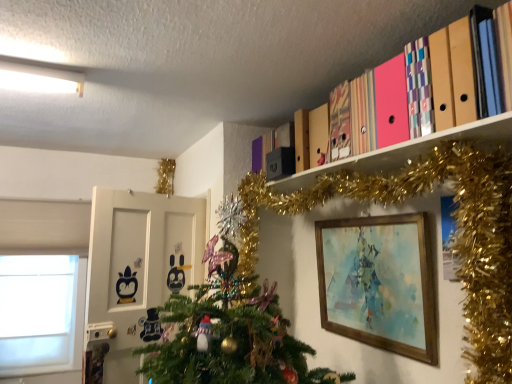
Question: Is green matte christmas tree at upper right inside the boundaries of matte cardboard folders at upper right, or outside?

Choices:
 (A) outside
 (B) inside

Answer: (A)

Question: In the image, is green matte christmas tree at upper right on the left side or the right side of matte cardboard folders at upper right?

Choices:
 (A) left
 (B) right

Answer: (A)

Question: Which of these objects is positioned closest to the matte cardboard folders at upper right?

Choices:
 (A) green matte christmas tree at upper right
 (B) white matte window at left
 (C) wooden picture frame at lower right

Answer: (A)

Question: Which is farther from the white matte window at left?

Choices:
 (A) matte cardboard folders at upper right
 (B) wooden picture frame at lower right
 (C) green matte christmas tree at upper right

Answer: (B)